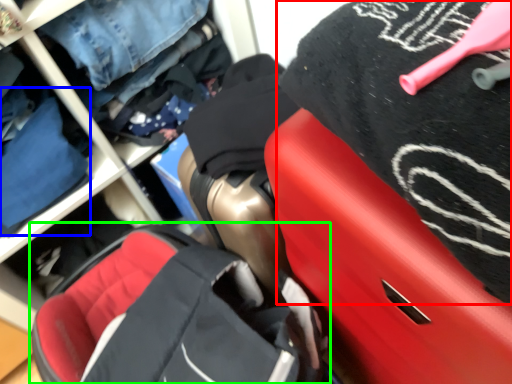
Question: Based on their relative distances, which object is nearer to clothing (highlighted by a red box)? Choose from clothing (highlighted by a blue box) and baby carriage (highlighted by a green box).

Choices:
 (A) clothing
 (B) baby carriage

Answer: (B)